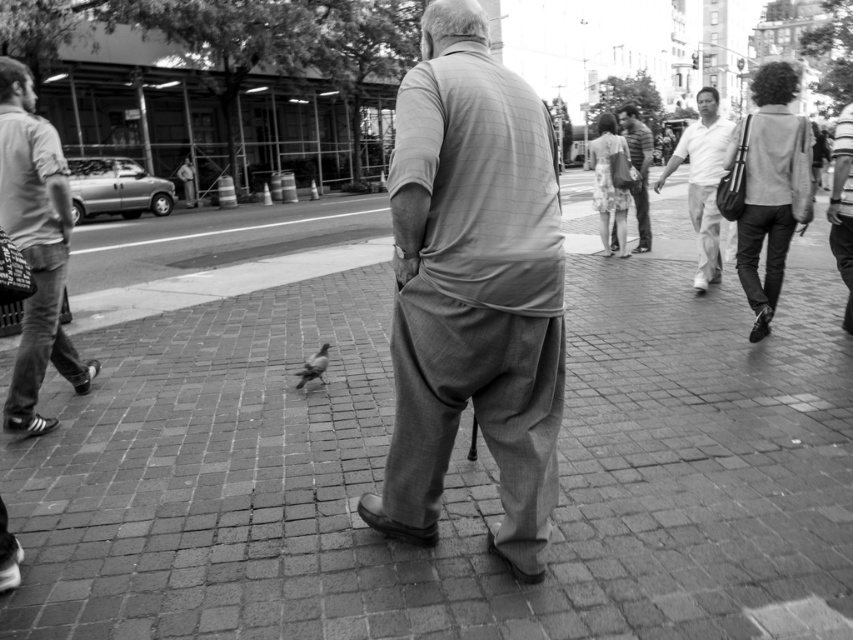
Who is higher up, light gray jeans at left or white cotton shirt at upper right?

Positioned higher is white cotton shirt at upper right.

You are a GUI agent. You are given a task and a screenshot of the screen. Output one action in this format:
    pyautogui.click(x=<x>, y=<y>)
    Task: Click on the light gray jeans at left
    The height and width of the screenshot is (640, 853).
    Given the screenshot: What is the action you would take?
    pyautogui.click(x=35, y=246)

You are a GUI agent. You are given a task and a screenshot of the screen. Output one action in this format:
    pyautogui.click(x=<x>, y=<y>)
    Task: Click on the light gray jeans at left
    The width and height of the screenshot is (853, 640).
    Given the screenshot: What is the action you would take?
    pyautogui.click(x=35, y=246)

Looking at this image, between light gray cotton pants at center and striped cotton shirt at center, which one appears on the right side from the viewer's perspective?

striped cotton shirt at center is more to the right.

Does point (534, 202) come farther from viewer compared to point (643, 227)?

No, (534, 202) is in front of (643, 227).

I want to click on light gray cotton pants at center, so click(473, 288).

Which is in front, point (99, 584) or point (700, 211)?

Positioned in front is point (99, 584).

Is brick pavement at center positioned at the back of white cotton shirt at upper right?

No.

Which is behind, point (627, 630) or point (730, 125)?

Positioned behind is point (730, 125).

Image resolution: width=853 pixels, height=640 pixels. What are the coordinates of `brick pavement at center` in the screenshot? It's located at (451, 452).